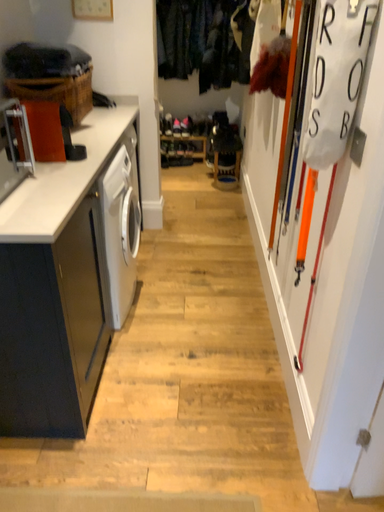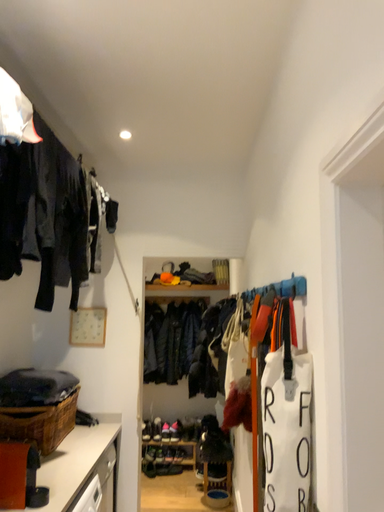
Question: How did the camera likely rotate when shooting the video?

Choices:
 (A) rotated downward
 (B) rotated upward

Answer: (B)